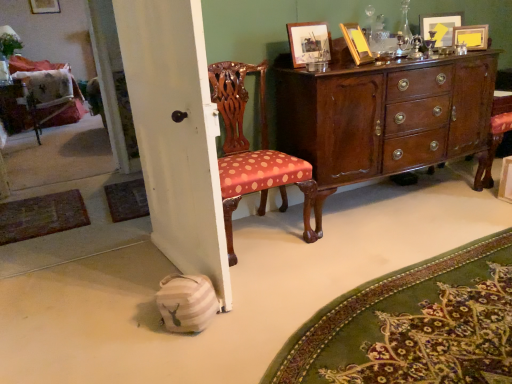
This screenshot has height=384, width=512. What are the coordinates of `free point below polished wood chair at center (from a real-world perspective)` in the screenshot? It's located at (257, 236).